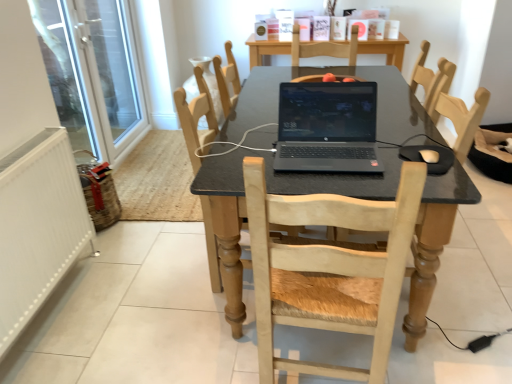
At what (x,y) coordinates should I click in order to perform the action: click on free spot behind white matte mouse at lower right. Please return your answer as a coordinate pair (x, y). Looking at the image, I should click on (396, 140).